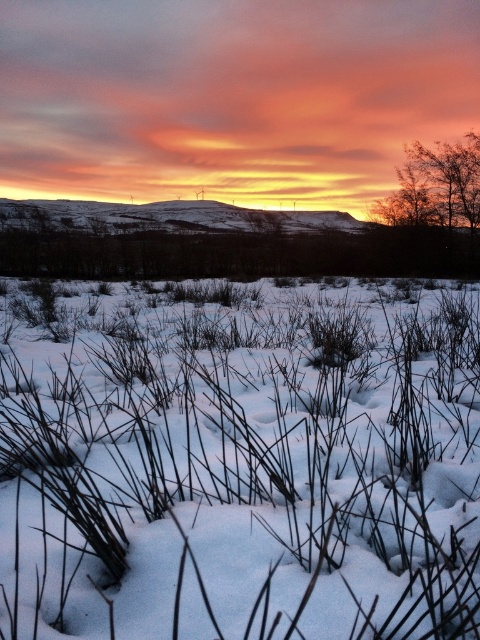
Question: Is brown dry grass at lower center to the right of brown textured tree at upper right from the viewer's perspective?

Choices:
 (A) no
 (B) yes

Answer: (A)

Question: From the image, what is the correct spatial relationship of brown dry grass at lower center in relation to brown textured tree at upper right?

Choices:
 (A) right
 (B) left

Answer: (B)

Question: Which point is closer to the camera taking this photo?

Choices:
 (A) pyautogui.click(x=389, y=474)
 (B) pyautogui.click(x=420, y=145)

Answer: (A)

Question: Considering the relative positions of brown dry grass at lower center and brown textured tree at upper right in the image provided, where is brown dry grass at lower center located with respect to brown textured tree at upper right?

Choices:
 (A) above
 (B) below

Answer: (B)